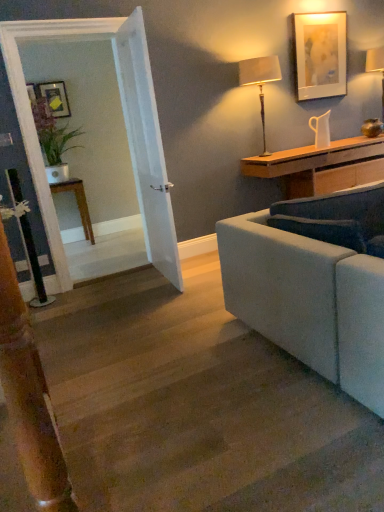
Find the location of `clear glass door at left`. clear glass door at left is located at coordinates (126, 131).

I want to click on white wooden door at left, so click(146, 145).

Describe the element at coordinates (146, 145) in the screenshot. I see `white wooden door at left` at that location.

The width and height of the screenshot is (384, 512). What do you see at coordinates (320, 55) in the screenshot? I see `matte white picture frame at upper right, arranged as the 1th picture frame when viewed from the front` at bounding box center [320, 55].

What do you see at coordinates (376, 67) in the screenshot? Image resolution: width=384 pixels, height=512 pixels. I see `matte gold vase at upper right, the 2th lamp when ordered from left to right` at bounding box center [376, 67].

Locate an element on the screen. The width and height of the screenshot is (384, 512). wooden stairs at lower left is located at coordinates (197, 406).

What is the approximate height of wooden stairs at lower left?

The height of wooden stairs at lower left is 9.30 centimeters.

I want to click on green leafy plant in pot at left, so click(53, 139).

There is a matte black picture frame at upper left, which appears as the second picture frame when viewed from the right. Identify the location of the 1st lamp below it (from the image's perspective). (376, 67).

Is matte black picture frame at upper left, marked as the second picture frame in a front-to-back arrangement, oriented away from matte gold vase at upper right, the first lamp viewed from the right?

matte black picture frame at upper left, marked as the second picture frame in a front-to-back arrangement, does not have its back to matte gold vase at upper right, the first lamp viewed from the right.

How distant is matte black picture frame at upper left, which ranks as the 1th picture frame in back-to-front order, from matte gold vase at upper right, which is counted as the 2th lamp, starting from the front?

A distance of 3.60 meters exists between matte black picture frame at upper left, which ranks as the 1th picture frame in back-to-front order, and matte gold vase at upper right, which is counted as the 2th lamp, starting from the front.

Could green leafy plant in pot at left be considered to be inside white wooden door at left?

No, green leafy plant in pot at left is located outside of white wooden door at left.

Considering the relative sizes of white wooden door at left and green leafy plant in pot at left in the image provided, is white wooden door at left wider than green leafy plant in pot at left?

No, white wooden door at left is not wider than green leafy plant in pot at left.

From the image's perspective, is white wooden door at left above green leafy plant in pot at left?

No, from the image's perspective, white wooden door at left is not over green leafy plant in pot at left.

Locate an element on the screen. The image size is (384, 512). houseplant located above the white wooden door at left (from a real-world perspective) is located at coordinates (53, 139).

Which is more to the left, matte gold vase at upper right, which is the 1th lamp from back to front, or matte white picture frame at upper right, which is the 2th picture frame from left to right?

matte white picture frame at upper right, which is the 2th picture frame from left to right, is more to the left.

Is matte gold vase at upper right, which is counted as the 2th lamp, starting from the front, positioned beyond the bounds of matte white picture frame at upper right, which is the second picture frame in back-to-front order?

Yes, matte gold vase at upper right, which is counted as the 2th lamp, starting from the front, is not within matte white picture frame at upper right, which is the second picture frame in back-to-front order.

Is point (383, 56) behind point (302, 14)?

Yes, point (383, 56) is behind point (302, 14).

In the image, is matte white picture frame at upper right, arranged as the 1th picture frame when viewed from the front, on the left side or the right side of green leafy plant in pot at left?

matte white picture frame at upper right, arranged as the 1th picture frame when viewed from the front, is to the right of green leafy plant in pot at left.

How different are the orientations of matte white picture frame at upper right, which is the 2th picture frame from left to right, and green leafy plant in pot at left in degrees?

0.185 degrees.

Looking at this image, could you tell me if matte white picture frame at upper right, which is the second picture frame in back-to-front order, is facing green leafy plant in pot at left?

No, matte white picture frame at upper right, which is the second picture frame in back-to-front order, does not turn towards green leafy plant in pot at left.

Considering the positions of point (310, 19) and point (42, 113), is point (310, 19) closer or farther from the camera than point (42, 113)?

Point (310, 19) is closer to the camera than point (42, 113).

Is matte beige lampshade at upper right, the 1th lamp viewed from the left, positioned with its back to wooden stairs at lower left?

No, matte beige lampshade at upper right, the 1th lamp viewed from the left, is not facing the opposite direction of wooden stairs at lower left.

Looking at this image, considering the relative positions of matte beige lampshade at upper right, the second lamp in the right-to-left sequence, and wooden stairs at lower left in the image provided, is matte beige lampshade at upper right, the second lamp in the right-to-left sequence, to the left of wooden stairs at lower left from the viewer's perspective?

No.

Is matte beige lampshade at upper right, which ranks as the 1th lamp in front-to-back order, in front of or behind wooden stairs at lower left in the image?

In the image, matte beige lampshade at upper right, which ranks as the 1th lamp in front-to-back order, appears behind wooden stairs at lower left.

Are matte beige lampshade at upper right, the 2th lamp in the back-to-front sequence, and wooden stairs at lower left located far from each other?

matte beige lampshade at upper right, the 2th lamp in the back-to-front sequence, is positioned a significant distance from wooden stairs at lower left.

Which is more to the right, brown wooden table at left or white ceramic pitcher at upper right?

From the viewer's perspective, white ceramic pitcher at upper right appears more on the right side.

From the image's perspective, is brown wooden table at left located beneath white ceramic pitcher at upper right?

Indeed, from the image's perspective, brown wooden table at left is shown beneath white ceramic pitcher at upper right.

Does point (50, 187) appear closer or farther from the camera than point (318, 129)?

Point (50, 187) is farther from the camera than point (318, 129).

From the picture: Is brown wooden table at left turned away from white ceramic pitcher at upper right?

That's not correct — brown wooden table at left is not looking away from white ceramic pitcher at upper right.

Based on the photo, is matte gold vase at upper right, which is counted as the 2th lamp, starting from the front, further to the viewer compared to white ceramic pitcher at upper right?

That is True.

Can you confirm if matte gold vase at upper right, the 2th lamp when ordered from left to right, is smaller than white ceramic pitcher at upper right?

No, matte gold vase at upper right, the 2th lamp when ordered from left to right, is not smaller than white ceramic pitcher at upper right.

Is there a large distance between matte gold vase at upper right, the 2th lamp when ordered from left to right, and white ceramic pitcher at upper right?

Absolutely, matte gold vase at upper right, the 2th lamp when ordered from left to right, is distant from white ceramic pitcher at upper right.

From the image's perspective, would you say matte gold vase at upper right, the 2th lamp when ordered from left to right, is positioned over white ceramic pitcher at upper right?

Yes, from the image's perspective, matte gold vase at upper right, the 2th lamp when ordered from left to right, is over white ceramic pitcher at upper right.

From a real-world perspective, which picture frame is the 1st one above the matte gold vase at upper right, the 2th lamp when ordered from left to right? Please provide its 2D coordinates.

[(55, 98)]

Locate an element on the screen. The width and height of the screenshot is (384, 512). houseplant behind the white wooden door at left is located at coordinates (53, 139).

Looking at the image, which one is located closer to matte white picture frame at upper right, which is the 1th picture frame in right-to-left order, wooden stairs at lower left or white ceramic pitcher at upper right?

The object closer to matte white picture frame at upper right, which is the 1th picture frame in right-to-left order, is white ceramic pitcher at upper right.

Looking at the image, which one is located closer to wooden stairs at lower left, matte white picture frame at upper right, which is the second picture frame in back-to-front order, or matte beige lampshade at upper right, the 2th lamp in the back-to-front sequence?

matte beige lampshade at upper right, the 2th lamp in the back-to-front sequence, is positioned closer to the anchor wooden stairs at lower left.

In the scene shown: Which object lies nearer to the anchor point green leafy plant in pot at left, white ceramic pitcher at upper right or matte white picture frame at upper right, which is the second picture frame in back-to-front order?

Among the two, matte white picture frame at upper right, which is the second picture frame in back-to-front order, is located nearer to green leafy plant in pot at left.

Estimate the real-world distances between objects in this image. Which object is further from wooden stairs at lower left, matte gold vase at upper right, the first lamp viewed from the right, or green leafy plant in pot at left?

The object further to wooden stairs at lower left is matte gold vase at upper right, the first lamp viewed from the right.

Looking at the image, which one is located further to white wooden door at left, clear glass door at left or matte gold vase at upper right, which is counted as the 2th lamp, starting from the front?

Among the two, matte gold vase at upper right, which is counted as the 2th lamp, starting from the front, is located further to white wooden door at left.

Which object lies nearer to the anchor point brown wooden table at left, matte white picture frame at upper right, which is the second picture frame in back-to-front order, or matte gold vase at upper right, which is the 1th lamp from back to front?

Based on the image, matte white picture frame at upper right, which is the second picture frame in back-to-front order, appears to be nearer to brown wooden table at left.

When comparing their distances from matte beige lampshade at upper right, the 2th lamp in the back-to-front sequence, does matte gold vase at upper right, the first lamp viewed from the right, or matte black picture frame at upper left, which appears as the second picture frame when viewed from the right, seem further?

matte black picture frame at upper left, which appears as the second picture frame when viewed from the right, is positioned further to the anchor matte beige lampshade at upper right, the 2th lamp in the back-to-front sequence.

Which object lies nearer to the anchor point matte gold vase at upper right, the first lamp viewed from the right, brown wooden table at left or white ceramic pitcher at upper right?

white ceramic pitcher at upper right is closer to matte gold vase at upper right, the first lamp viewed from the right.

This screenshot has width=384, height=512. Find the location of `vase situated between matte black picture frame at upper left, which ranks as the 1th picture frame in back-to-front order, and wooden desk at right from left to right`. vase situated between matte black picture frame at upper left, which ranks as the 1th picture frame in back-to-front order, and wooden desk at right from left to right is located at coordinates (321, 130).

Identify the location of houseplant between matte black picture frame at upper left, marked as the second picture frame in a front-to-back arrangement, and brown wooden table at left, in the vertical direction. The image size is (384, 512). (53, 139).

I want to click on door between matte black picture frame at upper left, which appears as the second picture frame when viewed from the right, and white ceramic pitcher at upper right from left to right, so click(x=146, y=145).

Identify the location of lamp between matte black picture frame at upper left, which ranks as the 1th picture frame in back-to-front order, and wooden desk at right from left to right. 260,81.